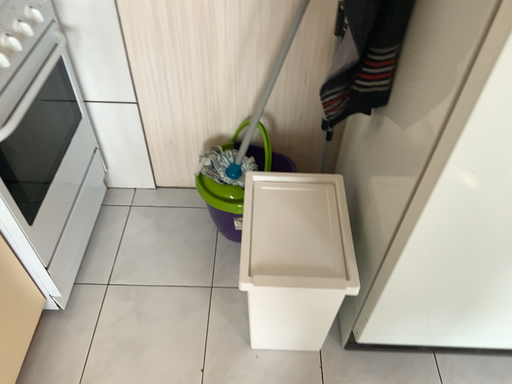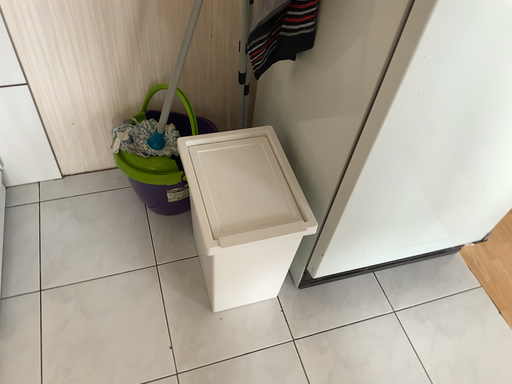
Question: Which way did the camera rotate in the video?

Choices:
 (A) rotated right
 (B) rotated left

Answer: (A)